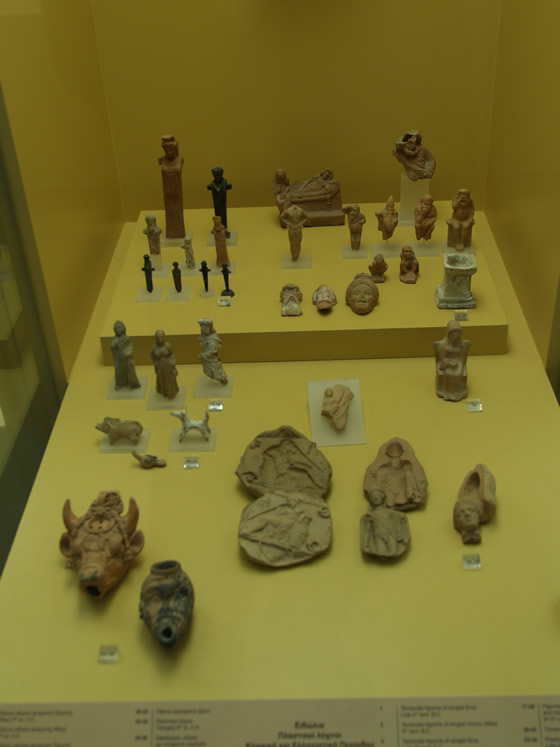
Where is `glass`? The width and height of the screenshot is (560, 747). glass is located at coordinates (28, 397).